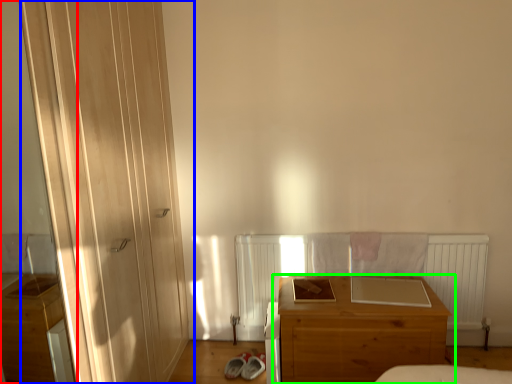
Question: Considering the real-world distances, which object is closest to screen door (highlighted by a red box)? door (highlighted by a blue box) or chest of drawers (highlighted by a green box).

Choices:
 (A) door
 (B) chest of drawers

Answer: (A)